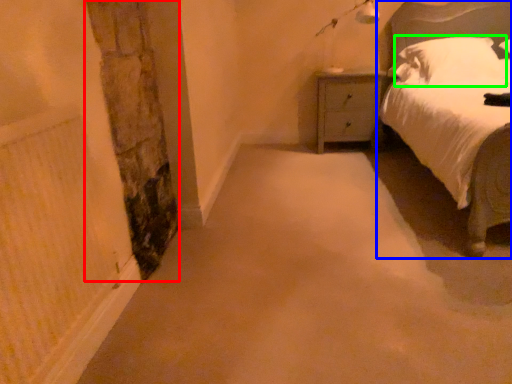
Question: Which is farther away from pillar (highlighted by a red box)? bed (highlighted by a blue box) or pillow (highlighted by a green box)?

Choices:
 (A) bed
 (B) pillow

Answer: (B)